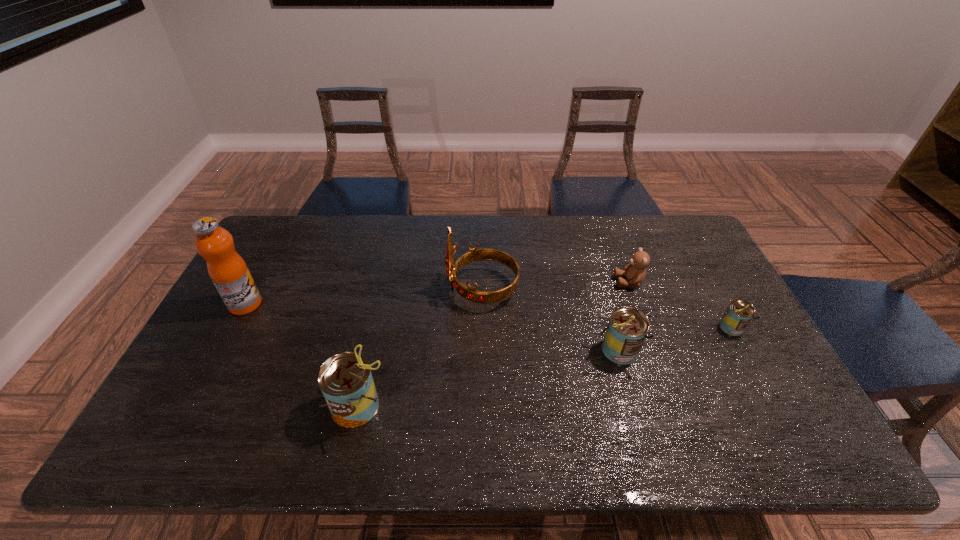
Where is `vacant region that satisfies the following two spatial constraints: 1. on the face of the rightmost object; 2. on the left side of the teddy bear`? The image size is (960, 540). vacant region that satisfies the following two spatial constraints: 1. on the face of the rightmost object; 2. on the left side of the teddy bear is located at coordinates (645, 328).

Find the location of `vacant area in the image that satisfies the following two spatial constraints: 1. on the face of the teddy bear; 2. on the front side of the second tallest can`. vacant area in the image that satisfies the following two spatial constraints: 1. on the face of the teddy bear; 2. on the front side of the second tallest can is located at coordinates (654, 351).

The width and height of the screenshot is (960, 540). I want to click on free spot that satisfies the following two spatial constraints: 1. on the face of the rightmost object; 2. on the left side of the teddy bear, so click(645, 328).

Where is `blank space that satisfies the following two spatial constraints: 1. on the front-facing side of the tiara; 2. on the left side of the fourth tallest object`? blank space that satisfies the following two spatial constraints: 1. on the front-facing side of the tiara; 2. on the left side of the fourth tallest object is located at coordinates (482, 351).

Find the location of a particular element. free location that satisfies the following two spatial constraints: 1. on the front-facing side of the tiara; 2. on the front side of the nearest object is located at coordinates (483, 406).

Where is `free location that satisfies the following two spatial constraints: 1. on the face of the shortest can; 2. on the right side of the teddy bear`? free location that satisfies the following two spatial constraints: 1. on the face of the shortest can; 2. on the right side of the teddy bear is located at coordinates (645, 328).